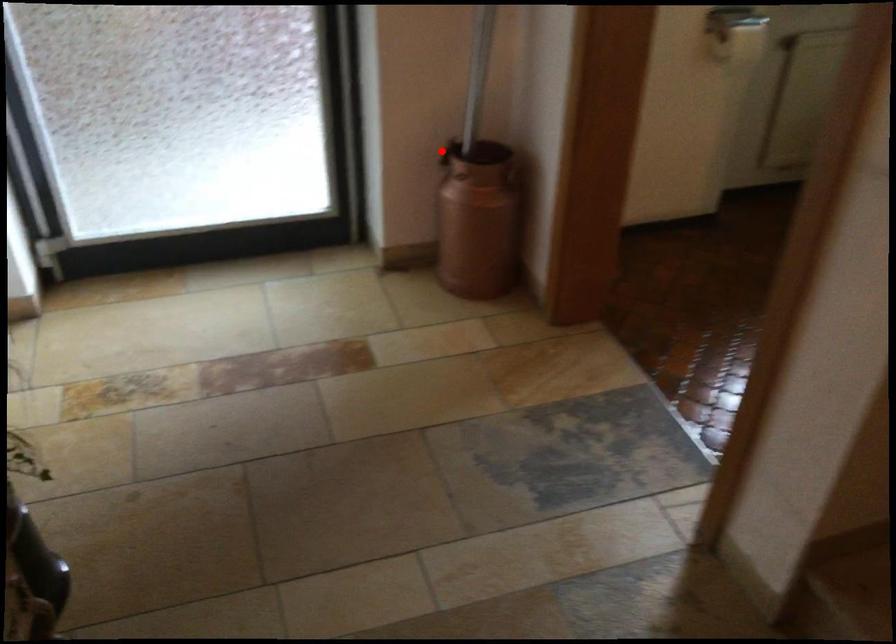
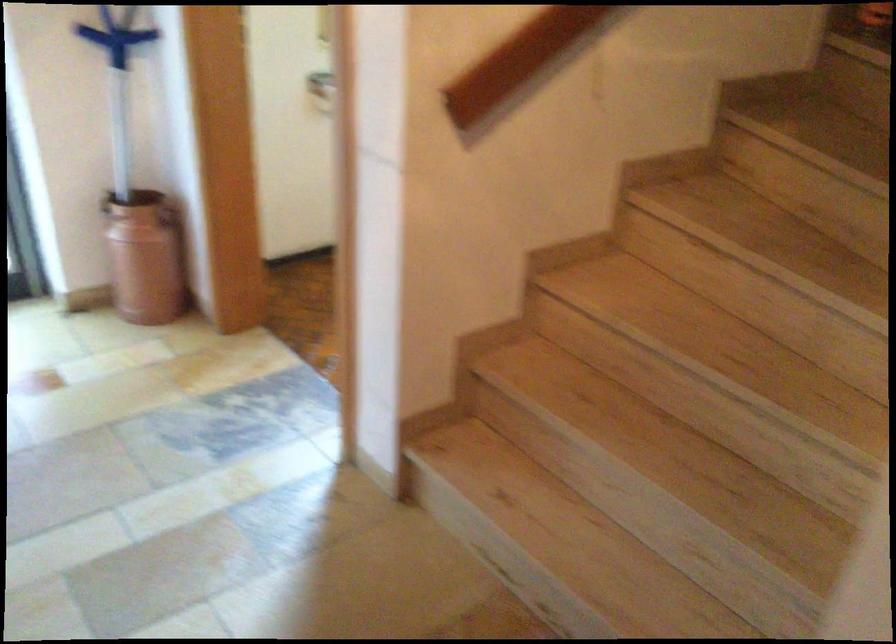
The point at the highlighted location is marked in the first image. Where is the corresponding point in the second image?

(105, 202)